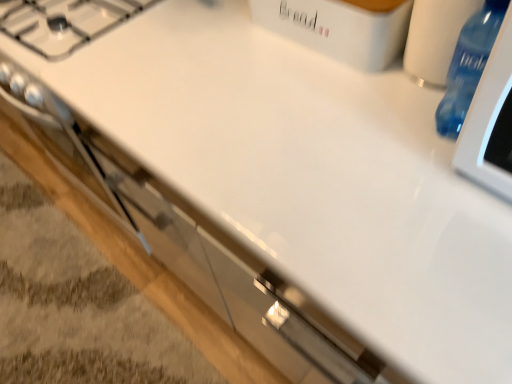
This screenshot has height=384, width=512. Identify the location of transparent plastic bottle at upper right. (468, 66).

Describe the element at coordinates (468, 66) in the screenshot. I see `transparent plastic bottle at upper right` at that location.

This screenshot has width=512, height=384. In order to click on transparent plastic bottle at upper right in this screenshot , I will do `click(468, 66)`.